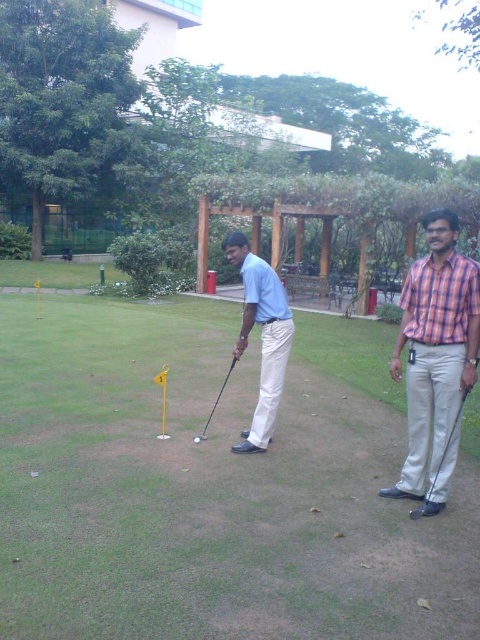
You are a golfer trying to hit the matte white golf ball at center into the hole. The metallic silver golf club at lower right is your only tool. Can you reach the ball with the club?

The matte white golf ball at center is to the left of the metallic silver golf club at lower right, so yes, you can reach the ball with the club since it is positioned within the club

You are organizing a golf tournament and need to ensure all participants wear shirts with a minimum width of 30 cm. Given the checkered fabric shirt at right and the matte blue shirt at center, which shirts meet the requirement?

The checkered fabric shirt at right has a larger width than the matte blue shirt at center. Since the checkered fabric shirt at right is wider, it likely meets the 30 cm requirement, while the matte blue shirt at center may not.

You are a drone operator trying to capture a closeup of the two points in the image. The first point is at coordinate point (345,621) and the second point is at coordinate point (432,480). Which point should you adjust your drone to focus on first to ensure it is closer to the camera?

Point (345,621) is closer to the viewer than point (432,480), so you should focus on point (345,621) first to ensure it is closer to the camera.